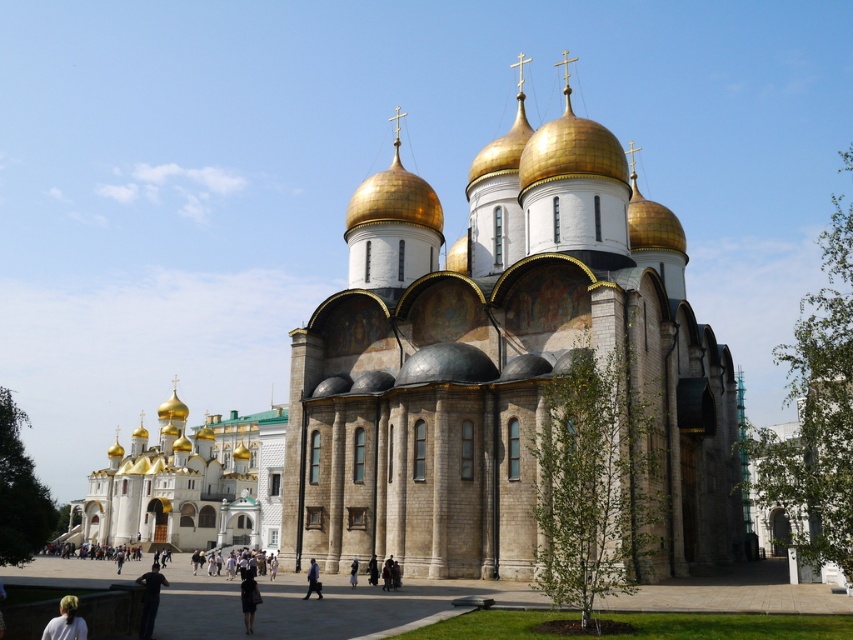
Question: Among these objects, which one is nearest to the camera?

Choices:
 (A) dark blue fabric at lower left
 (B) gold domed church at left

Answer: (A)

Question: Is dark blue fabric at lower left positioned in front of dark blue jeans at center?

Choices:
 (A) yes
 (B) no

Answer: (A)

Question: Is dark blue jeans at center below dark brown leather jacket at center?

Choices:
 (A) no
 (B) yes

Answer: (B)

Question: Does gold domed church at left have a smaller size compared to dark blue fabric at center?

Choices:
 (A) yes
 (B) no

Answer: (B)

Question: Which point is farther to the camera?

Choices:
 (A) dark blue fabric at center
 (B) gold domed church at left

Answer: (B)

Question: Considering the real-world distances, which object is farthest from the stone church at center?

Choices:
 (A) dark blue fabric at lower left
 (B) dark blue dress at center

Answer: (A)